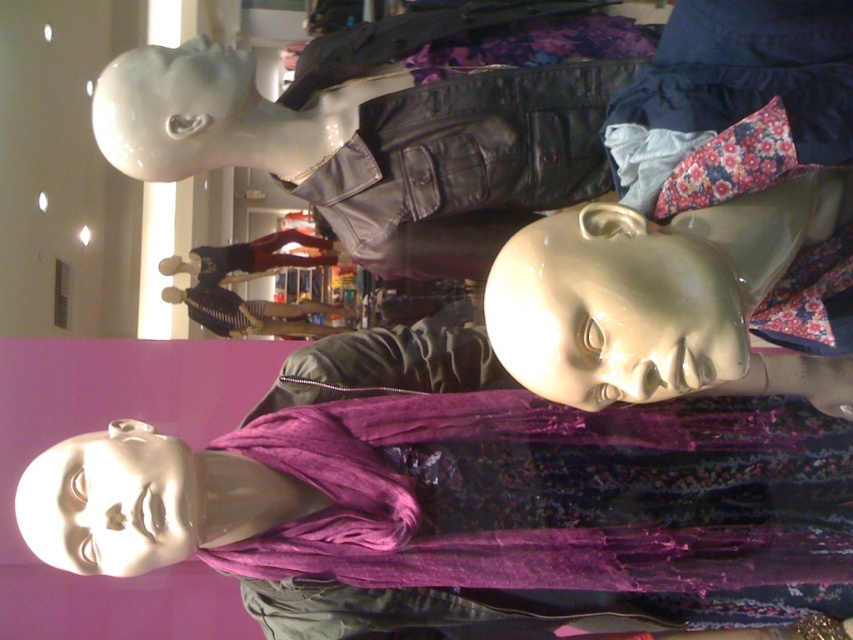
You are a customer in the store and want to touch the glossy plastic head at center and the matte white face at center. Which one can you reach without moving closer?

The glossy plastic head at center is closer to the viewer than the matte white face at center, so you can reach the glossy plastic head at center without moving closer.

Looking at this image, you are a customer entering the store and notice two white objects in the display area. One is labeled as the matte white face at center and the other as the glossy white head at upper center. Which one is positioned higher up?

The glossy white head at upper center is positioned higher up than the matte white face at center.